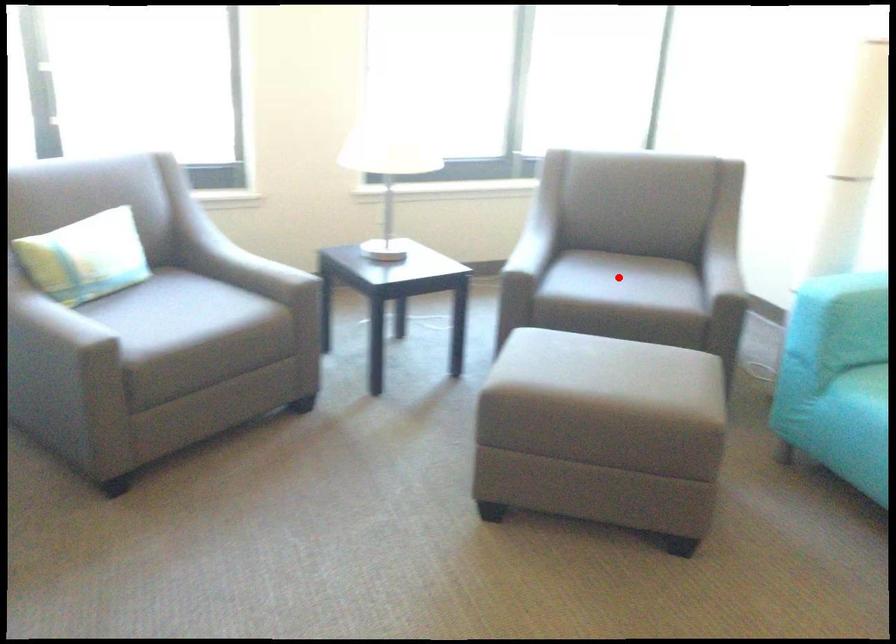
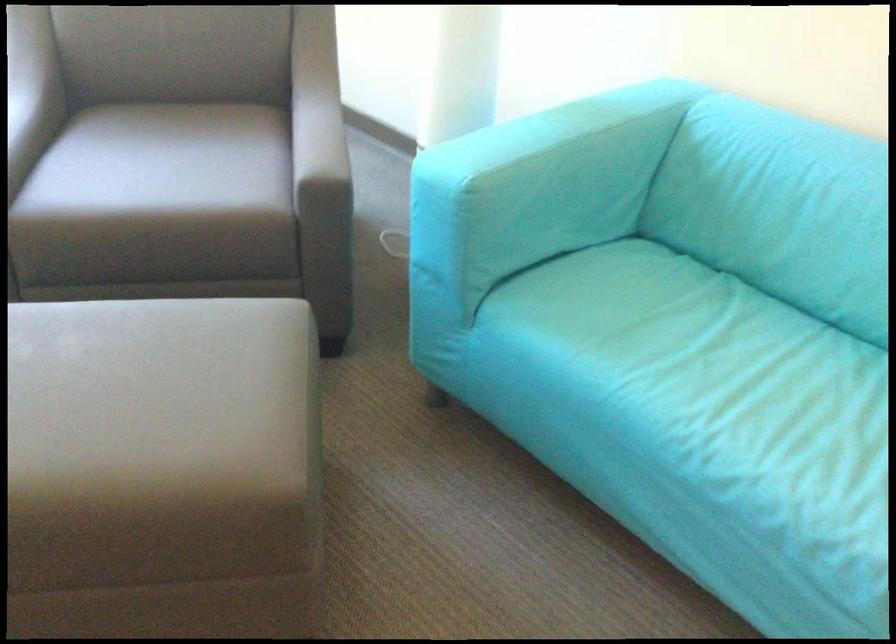
Find the pixel in the second image that matches the highlighted location in the first image.

(170, 158)